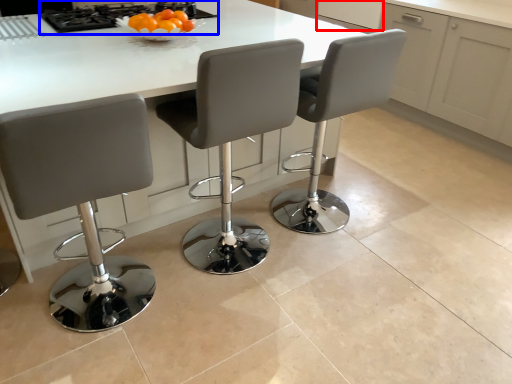
Question: Which point is further to the camera, cabinetry (highlighted by a red box) or gas stove (highlighted by a blue box)?

Choices:
 (A) cabinetry
 (B) gas stove

Answer: (A)